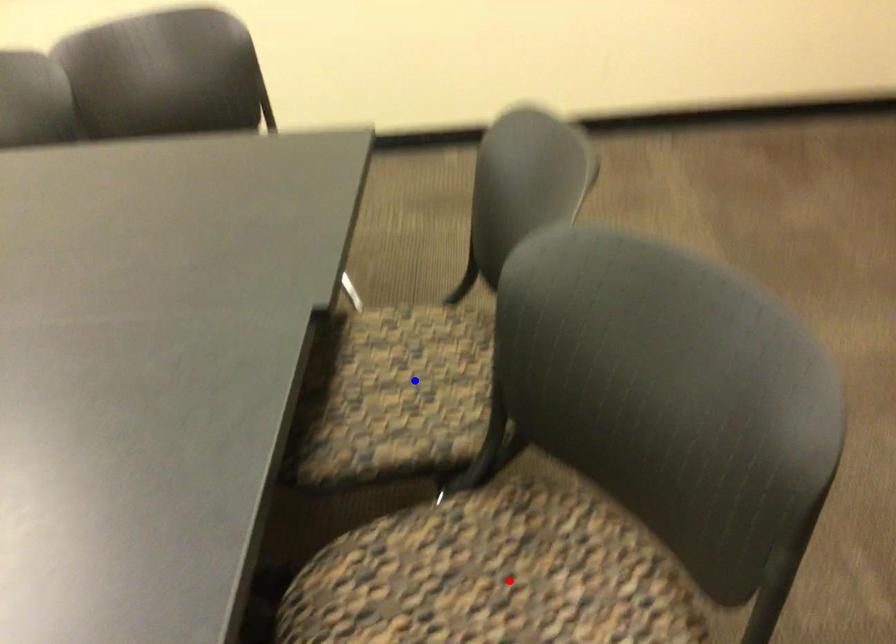
Question: Two points are marked on the image. Which point is closer to the camera?

Choices:
 (A) Blue point is closer.
 (B) Red point is closer.

Answer: (B)